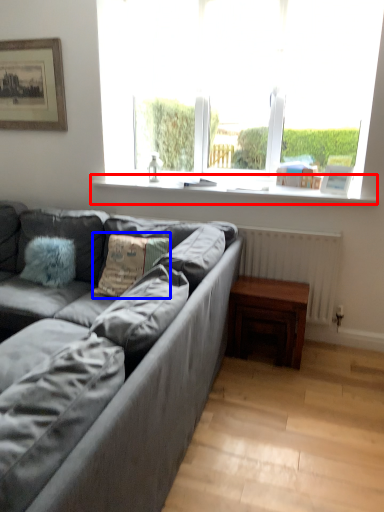
Question: Which point is closer to the camera, window sill (highlighted by a red box) or pillow (highlighted by a blue box)?

Choices:
 (A) window sill
 (B) pillow

Answer: (B)